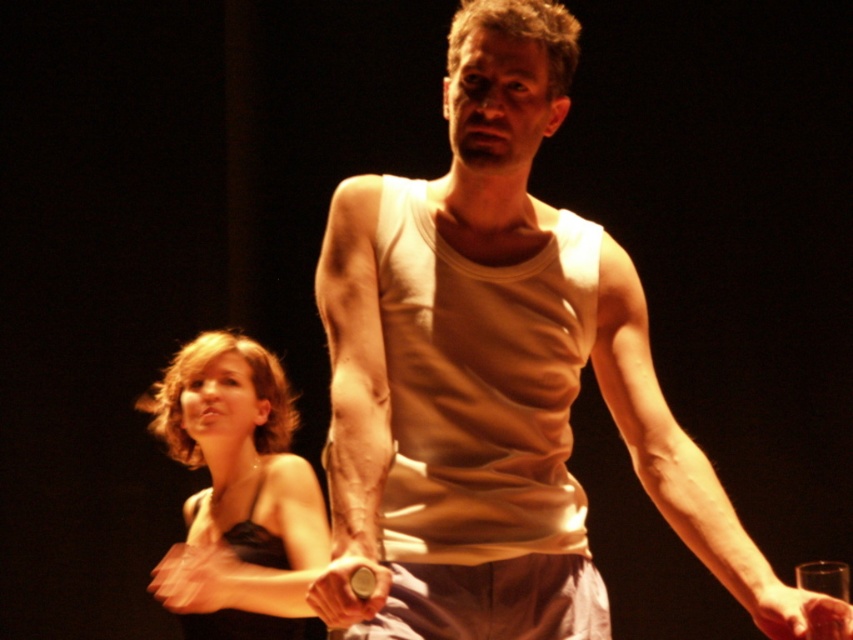
You are a photographer adjusting the lighting in the scene. You need to ensure that both the satin black dress at lower left and the matte black hand at lower left are fully illuminated. Given their sizes, which object requires a wider light beam to cover its entire surface?

The satin black dress at lower left requires a wider light beam because its width is larger than the matte black hand at lower left.

Where is the white cotton tank top at center located in the image?

The white cotton tank top at center is located at point (x=492, y=365) in the image.